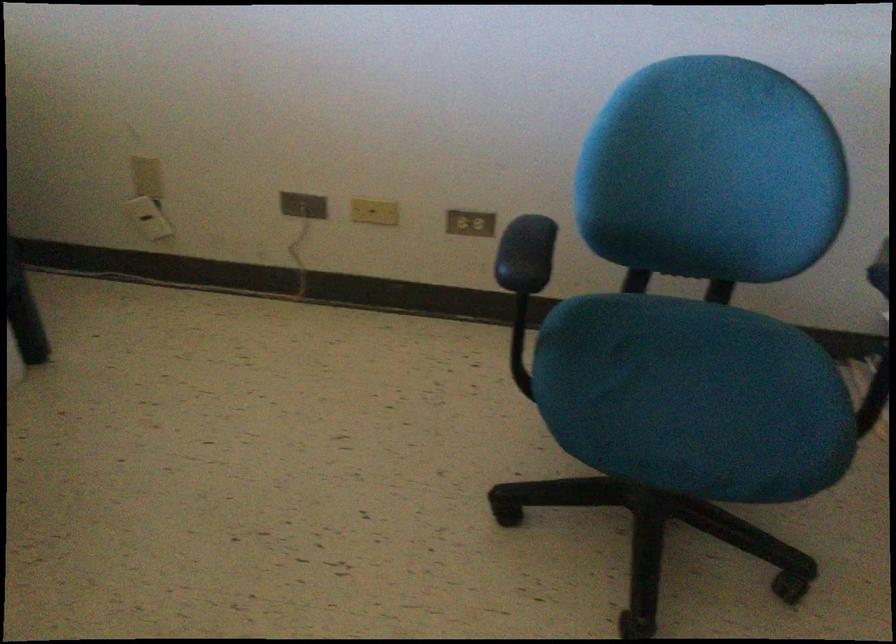
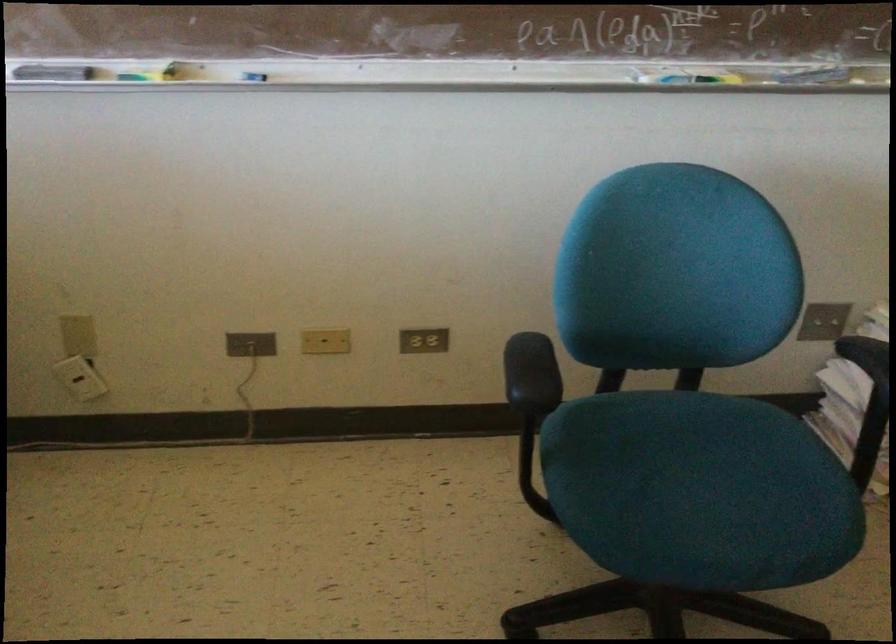
Locate, in the second image, the point that corresponds to [467,223] in the first image.

(423, 341)